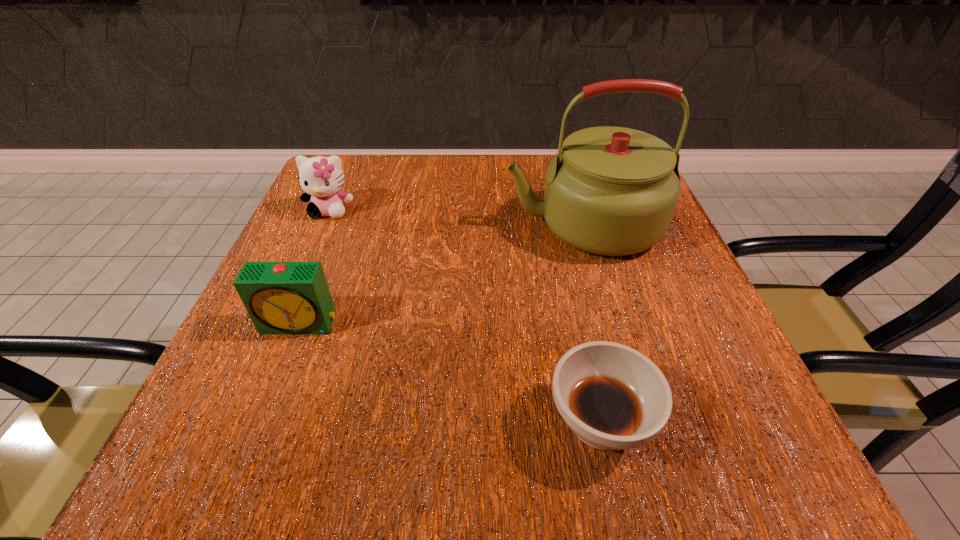
Where is `empty space that is in between the alarm clock and the kettle`? The image size is (960, 540). empty space that is in between the alarm clock and the kettle is located at coordinates (442, 274).

This screenshot has width=960, height=540. What are the coordinates of `vacant space that is in between the alarm clock and the soup bowl` in the screenshot? It's located at (450, 373).

The image size is (960, 540). Find the location of `empty location between the tallest object and the soup bowl`. empty location between the tallest object and the soup bowl is located at coordinates click(x=591, y=323).

Where is `vacant region between the kitten and the nearest object`? The width and height of the screenshot is (960, 540). vacant region between the kitten and the nearest object is located at coordinates (465, 316).

Identify the location of object that stands as the second closest to the kitten. [612, 191].

Locate which object ranks third in proximity to the kitten. Please provide its 2D coordinates. Your answer should be formatted as a tuple, i.e. [(x, y)], where the tuple contains the x and y coordinates of a point satisfying the conditions above.

[(613, 397)]

Where is `free space that satisfies the following two spatial constraints: 1. on the front-facing side of the nearest object; 2. on the right side of the second nearest object`? The width and height of the screenshot is (960, 540). free space that satisfies the following two spatial constraints: 1. on the front-facing side of the nearest object; 2. on the right side of the second nearest object is located at coordinates (261, 422).

You are a GUI agent. You are given a task and a screenshot of the screen. Output one action in this format:
    pyautogui.click(x=<x>, y=<y>)
    Task: Click on the free location that satisfies the following two spatial constraints: 1. at the spout of the tallest object; 2. on the front side of the shortest object
    
    Given the screenshot: What is the action you would take?
    pyautogui.click(x=640, y=422)

Where is `vacant region that satisfies the following two spatial constraints: 1. on the front-facing side of the soup bowl; 2. on the left side of the alarm clock`? vacant region that satisfies the following two spatial constraints: 1. on the front-facing side of the soup bowl; 2. on the left side of the alarm clock is located at coordinates (261, 422).